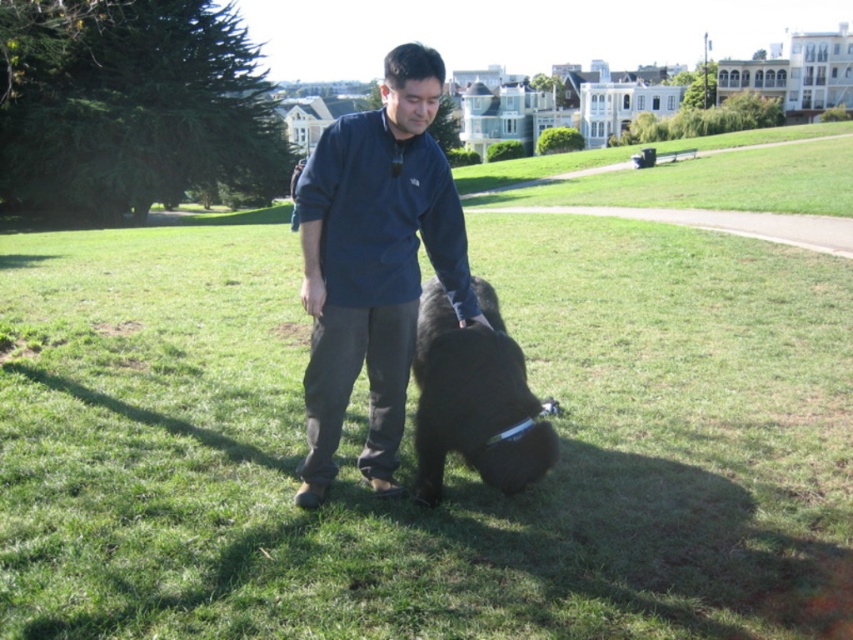
Question: Where is dark blue fleece at center located in relation to black fur dog at center in the image?

Choices:
 (A) left
 (B) right

Answer: (A)

Question: Observing the image, what is the correct spatial positioning of dark blue fleece at center in reference to black fur dog at center?

Choices:
 (A) above
 (B) below

Answer: (A)

Question: Observing the image, what is the correct spatial positioning of dark blue fleece at center in reference to black fur dog at center?

Choices:
 (A) below
 (B) above

Answer: (B)

Question: Among these points, which one is farthest from the camera?

Choices:
 (A) (395, 86)
 (B) (480, 410)

Answer: (B)